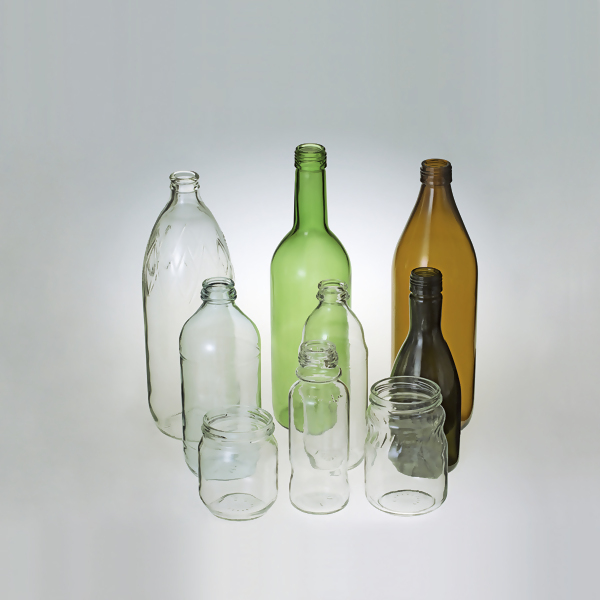
The width and height of the screenshot is (600, 600). I want to click on glass bottles, so click(185, 240), click(320, 240), click(435, 246), click(430, 337), click(335, 327), click(226, 354), click(329, 409).